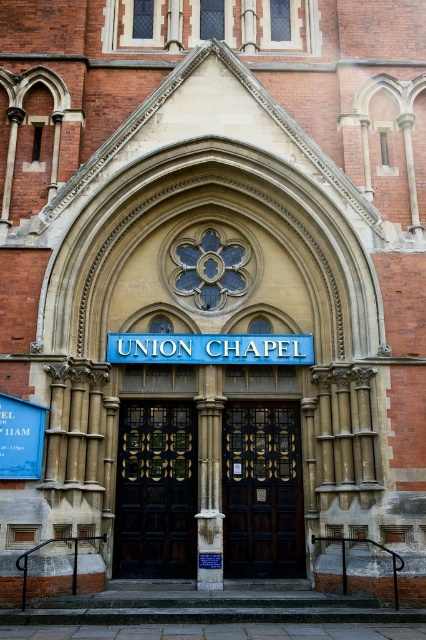
Can you confirm if dark wood door at center is shorter than blue metallic sign at center?

In fact, dark wood door at center may be taller than blue metallic sign at center.

This screenshot has height=640, width=426. What do you see at coordinates (261, 490) in the screenshot? I see `dark wood door at center` at bounding box center [261, 490].

Where is `dark wood door at center`? The height and width of the screenshot is (640, 426). dark wood door at center is located at coordinates (261, 490).

Is black polished wood door at center smaller than blue metallic sign at center?

Actually, black polished wood door at center might be larger than blue metallic sign at center.

In the scene shown: Who is lower down, black polished wood door at center or blue metallic sign at center?

black polished wood door at center

Is point (184, 445) positioned in front of point (239, 349)?

No, (184, 445) is further to viewer.

Find the location of a particular element. black polished wood door at center is located at coordinates (155, 490).

Between black polished wood door at center and dark wood door at center, which one has less height?

black polished wood door at center

Does black polished wood door at center have a greater height compared to dark wood door at center?

Incorrect, black polished wood door at center's height is not larger of dark wood door at center's.

I want to click on black polished wood door at center, so click(x=155, y=490).